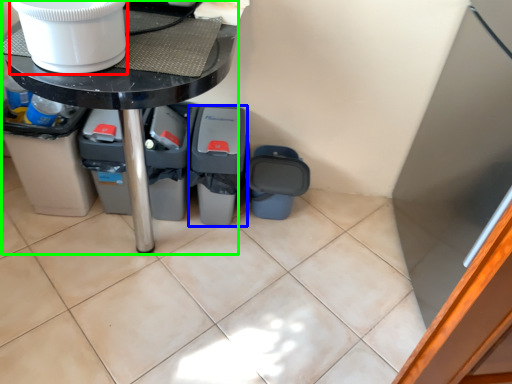
Question: Which object is positioned farthest from toilet bowl (highlighted by a red box)? Select from recycling bin (highlighted by a blue box) and table (highlighted by a green box).

Choices:
 (A) recycling bin
 (B) table

Answer: (A)